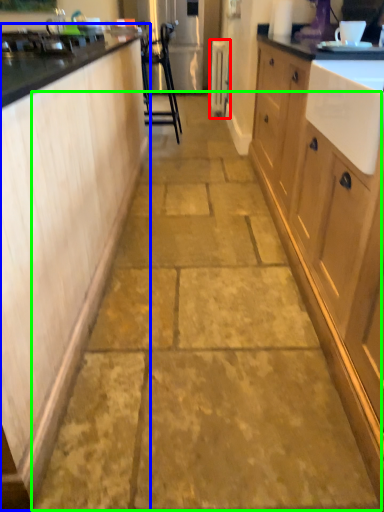
Question: Based on their relative distances, which object is farther from appliance (highlighted by a red box)? Choose from cabinetry (highlighted by a blue box) and path (highlighted by a green box).

Choices:
 (A) cabinetry
 (B) path

Answer: (A)